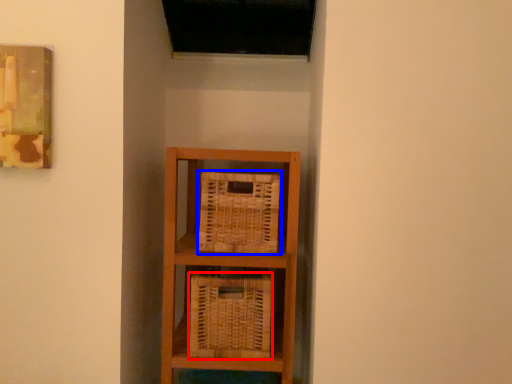
Question: Among these objects, which one is farthest to the camera, basket (highlighted by a red box) or basket (highlighted by a blue box)?

Choices:
 (A) basket
 (B) basket

Answer: (B)